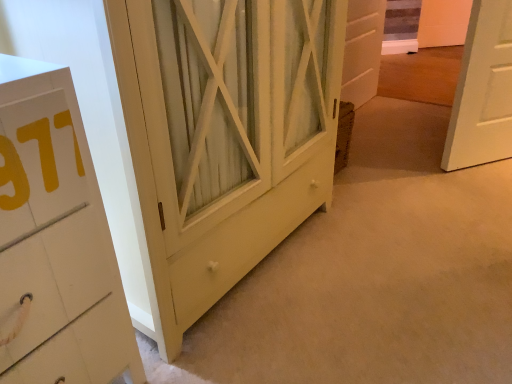
What is the approximate height of white wood door at center?

The height of white wood door at center is 71.95 centimeters.

Identify the location of white wood door at center. (362, 50).

The image size is (512, 384). What do you see at coordinates (362, 50) in the screenshot?
I see `white wood door at center` at bounding box center [362, 50].

The image size is (512, 384). Identify the location of matte yellow cabinet at center. (225, 134).

The image size is (512, 384). What do you see at coordinates (225, 134) in the screenshot? I see `matte yellow cabinet at center` at bounding box center [225, 134].

The height and width of the screenshot is (384, 512). What are the coordinates of `white wood door at center` in the screenshot? It's located at (362, 50).

Is white wood door at center at the left side of matte yellow cabinet at center?

No, white wood door at center is not to the left of matte yellow cabinet at center.

Which object is further away from the camera taking this photo, white wood door at center or matte yellow cabinet at center?

white wood door at center.

Between point (344, 52) and point (307, 193), which one is positioned in front?

The point (307, 193) is closer to the camera.

Based on the photo, from the image's perspective, is white wood door at center located above or below matte yellow cabinet at center?

From the image's perspective, white wood door at center appears above matte yellow cabinet at center.

From a real-world perspective, which object rests below the other?

In real-world perspective, white wood door at center is lower.

Between white wood door at center and matte yellow cabinet at center, which one has smaller width?

With smaller width is white wood door at center.

Which of these two, white wood door at center or matte yellow cabinet at center, stands shorter?

white wood door at center is shorter.

Considering the sizes of objects white wood door at center and matte yellow cabinet at center in the image provided, who is bigger, white wood door at center or matte yellow cabinet at center?

matte yellow cabinet at center.

Is white wood door at center surrounding matte yellow cabinet at center?

That's incorrect, matte yellow cabinet at center is not inside white wood door at center.

Is white wood door at center with matte yellow cabinet at center?

white wood door at center and matte yellow cabinet at center are not in contact.

Is white wood door at center facing towards matte yellow cabinet at center?

No, white wood door at center does not turn towards matte yellow cabinet at center.

How many degrees apart are the facing directions of white wood door at center and matte yellow cabinet at center?

The angular difference between white wood door at center and matte yellow cabinet at center is 0.982 degrees.

Where is `door on the right of matte yellow cabinet at center`? The height and width of the screenshot is (384, 512). door on the right of matte yellow cabinet at center is located at coordinates (362, 50).

Which is more to the left, matte yellow cabinet at center or white wood door at center?

Positioned to the left is matte yellow cabinet at center.

Is matte yellow cabinet at center in front of or behind white wood door at center in the image?

In the image, matte yellow cabinet at center appears in front of white wood door at center.

Is point (165, 342) positioned behind point (365, 98)?

That is False.

From the image's perspective, does matte yellow cabinet at center appear lower than white wood door at center?

Yes.

From a real-world perspective, who is located lower, matte yellow cabinet at center or white wood door at center?

In real-world perspective, white wood door at center is lower.

Can you confirm if matte yellow cabinet at center is thinner than white wood door at center?

No.

Can you confirm if matte yellow cabinet at center is shorter than white wood door at center?

No, matte yellow cabinet at center is not shorter than white wood door at center.

Considering the relative sizes of matte yellow cabinet at center and white wood door at center in the image provided, is matte yellow cabinet at center bigger than white wood door at center?

Correct, matte yellow cabinet at center is larger in size than white wood door at center.

Do you think matte yellow cabinet at center is within white wood door at center, or outside of it?

matte yellow cabinet at center is located beyond the bounds of white wood door at center.

Would you say matte yellow cabinet at center is a long distance from white wood door at center?

matte yellow cabinet at center is far away from white wood door at center.

Does matte yellow cabinet at center turn towards white wood door at center?

No, matte yellow cabinet at center is not turned towards white wood door at center.

Locate an element on the screen. door behind the matte yellow cabinet at center is located at coordinates (362, 50).

Identify the location of barn door that is below the white wood door at center (from the image's perspective). This screenshot has height=384, width=512. (225, 134).

The height and width of the screenshot is (384, 512). In order to click on door on the right of matte yellow cabinet at center in this screenshot , I will do `click(362, 50)`.